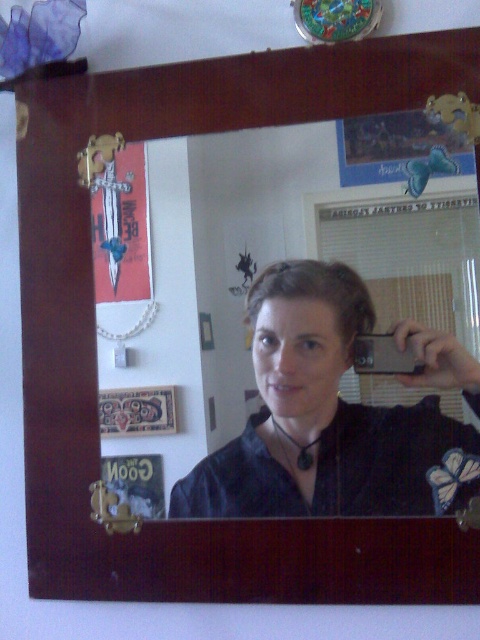
Can you confirm if matte black shirt at center is smaller than wooden picture frame at lower left?

Actually, matte black shirt at center might be larger than wooden picture frame at lower left.

Locate an element on the screen. This screenshot has width=480, height=640. matte black shirt at center is located at coordinates (325, 419).